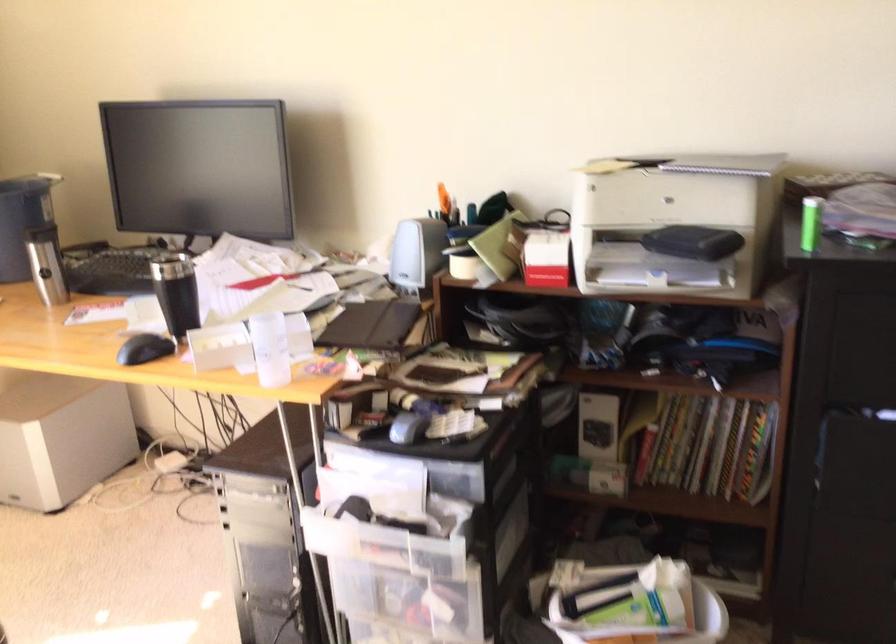
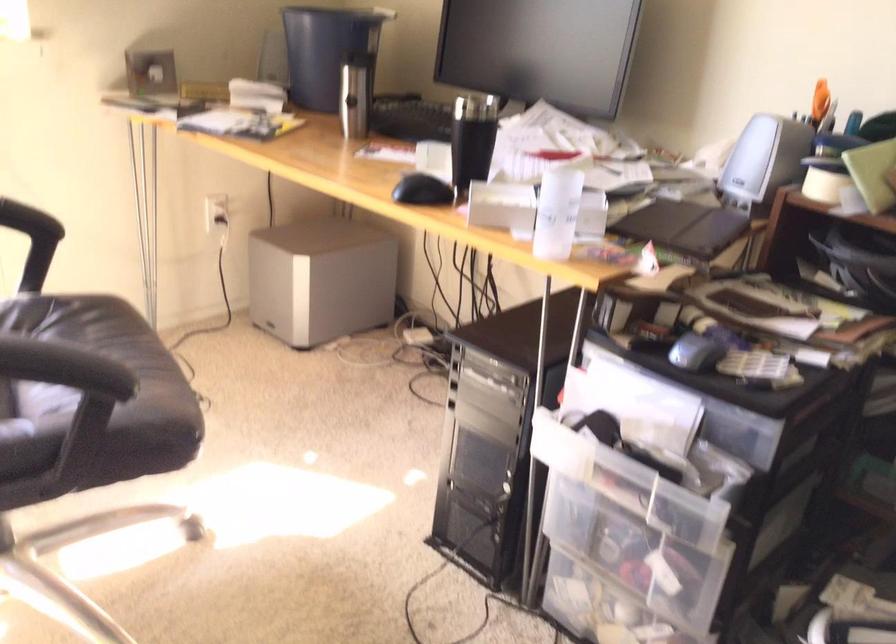
Find the pixel in the second image that matches point (149, 346) in the first image.

(421, 190)